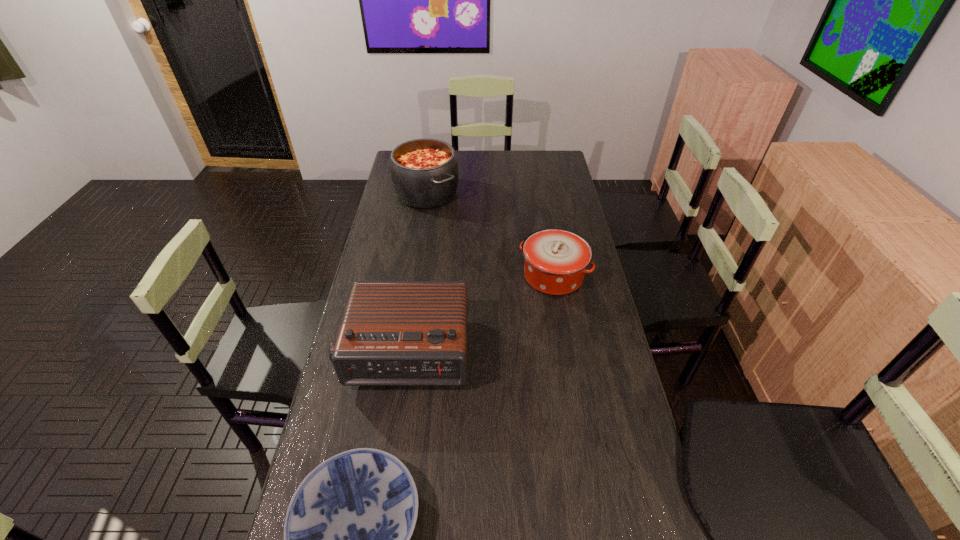
Identify the location of the left casserole. (424, 172).

Where is `the farthest object`? This screenshot has height=540, width=960. the farthest object is located at coordinates (424, 172).

Find the location of `radio receiver`. radio receiver is located at coordinates tap(394, 333).

Identify the location of the second shortest object. (556, 259).

The image size is (960, 540). I want to click on the nearer casserole, so click(x=556, y=259).

Locate an element on the screen. vacant space located on the right of the farther casserole is located at coordinates (498, 193).

You are a GUI agent. You are given a task and a screenshot of the screen. Output one action in this format:
    pyautogui.click(x=<x>, y=<y>)
    Task: Click on the free space located on the tuning display of the third farthest object
    This screenshot has height=540, width=960.
    Given the screenshot: What is the action you would take?
    pyautogui.click(x=394, y=434)

Where is `vacant area situated 0.070m on the front of the rightmost object`? Image resolution: width=960 pixels, height=540 pixels. vacant area situated 0.070m on the front of the rightmost object is located at coordinates (561, 316).

I want to click on object present at the far edge, so click(x=424, y=172).

Where is `casserole that is at the left edge`? This screenshot has width=960, height=540. casserole that is at the left edge is located at coordinates (424, 172).